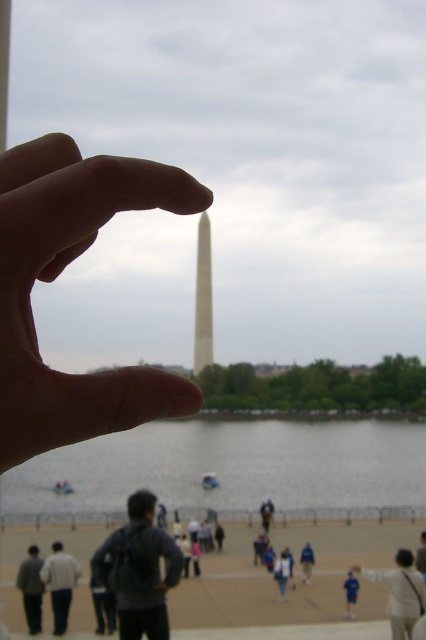
Does dark gray backpack at center appear on the left side of light blue denim jacket at lower center?

Yes, dark gray backpack at center is to the left of light blue denim jacket at lower center.

Between dark gray backpack at center and light blue denim jacket at lower center, which one is positioned lower?

light blue denim jacket at lower center is below.

Locate an element on the screen. dark gray backpack at center is located at coordinates (138, 570).

How distant is light blue shirt at lower right from light gray sweater at lower left?

76.18 feet

Can you confirm if light blue shirt at lower right is thinner than light gray sweater at lower left?

In fact, light blue shirt at lower right might be wider than light gray sweater at lower left.

Who is more forward, [408,556] or [58,588]?

Point [58,588]

Identify the location of light blue shirt at lower right. (400, 593).

Can you confirm if light gray sweater at lower left is wider than light blue denim jacket at lower center?

No.

Measure the distance between light gray sweater at lower left and light blue denim jacket at lower center.

light gray sweater at lower left is 15.04 meters from light blue denim jacket at lower center.

The image size is (426, 640). What do you see at coordinates (60, 582) in the screenshot?
I see `light gray sweater at lower left` at bounding box center [60, 582].

At what (x,y) coordinates should I click in order to perform the action: click on light gray sweater at lower left. Please return your answer as a coordinate pair (x, y). This screenshot has width=426, height=640. Looking at the image, I should click on (60, 582).